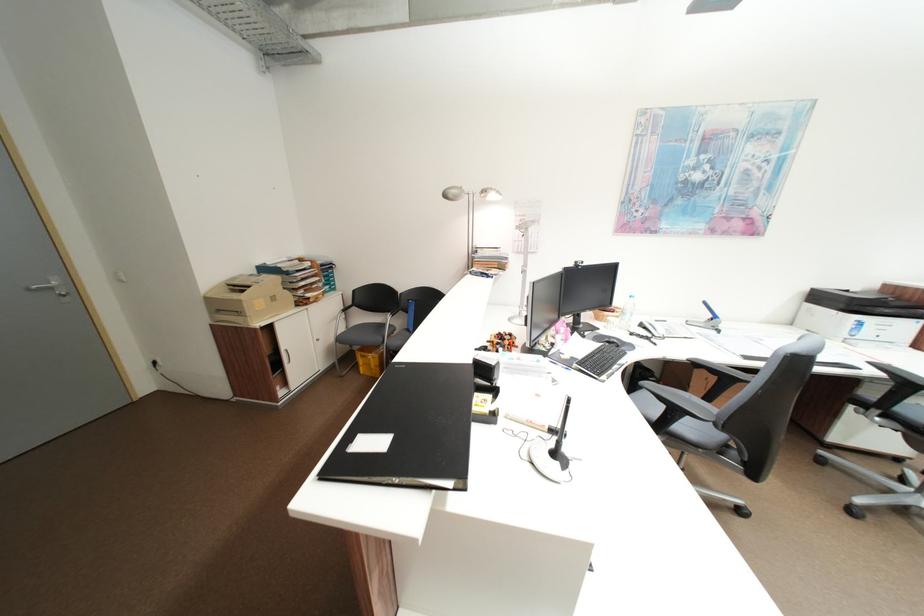
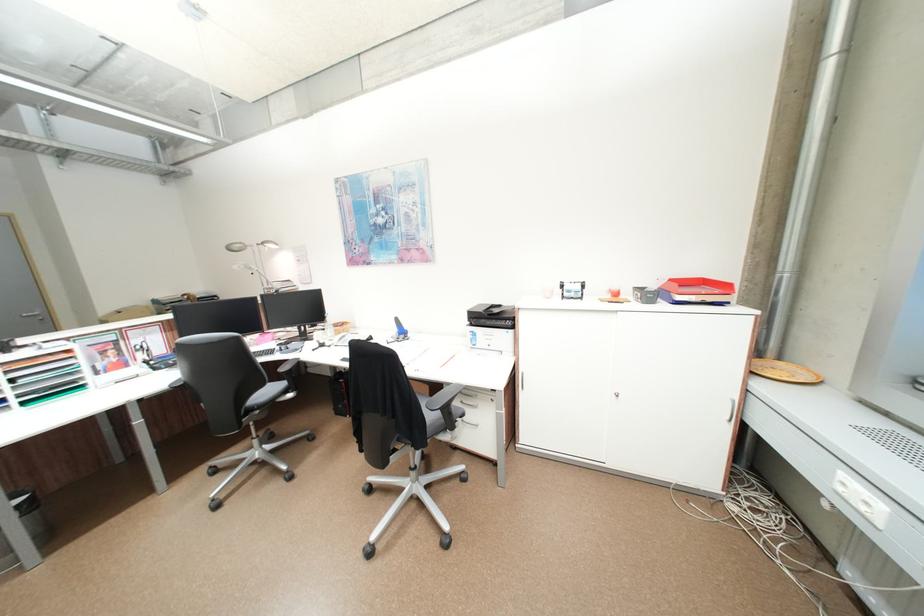
Find the pixel in the second image that matches (502,197) in the first image.

(281, 246)